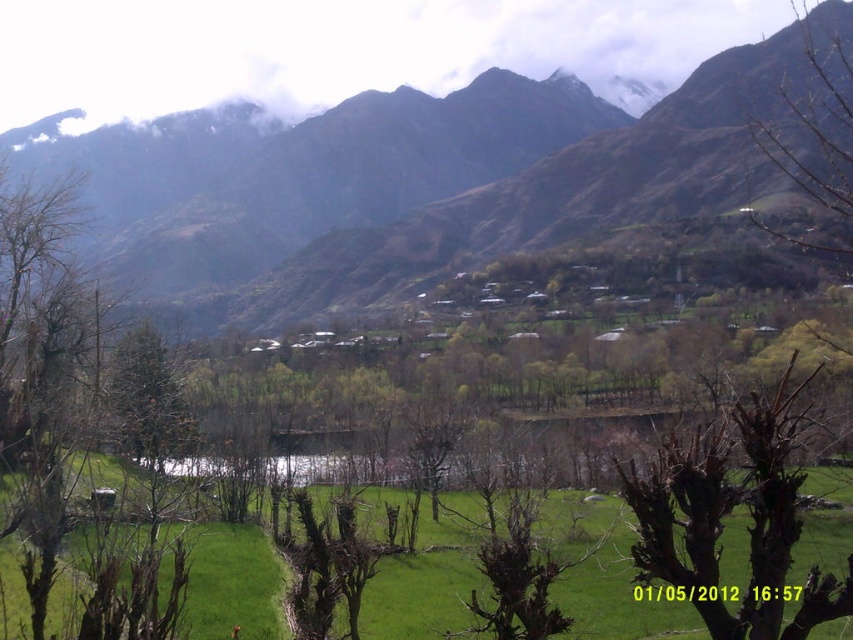
You are standing at the center of the green field in the image. Looking towards the mountain range, where would you see the green leafy tree at left relative to your position?

The green leafy tree at left is located at coordinates approximately 0.583 on the x axis and 0.052 on the y axis, meaning it is positioned to the left side of the field near the lower edge.